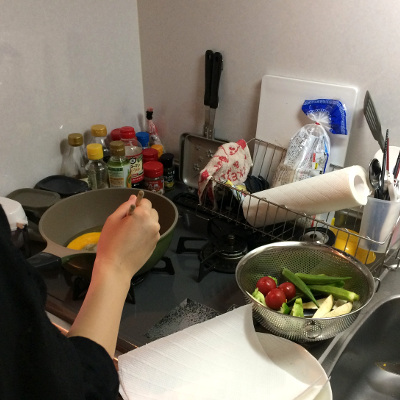
Identify the location of paper towel. (226, 330).